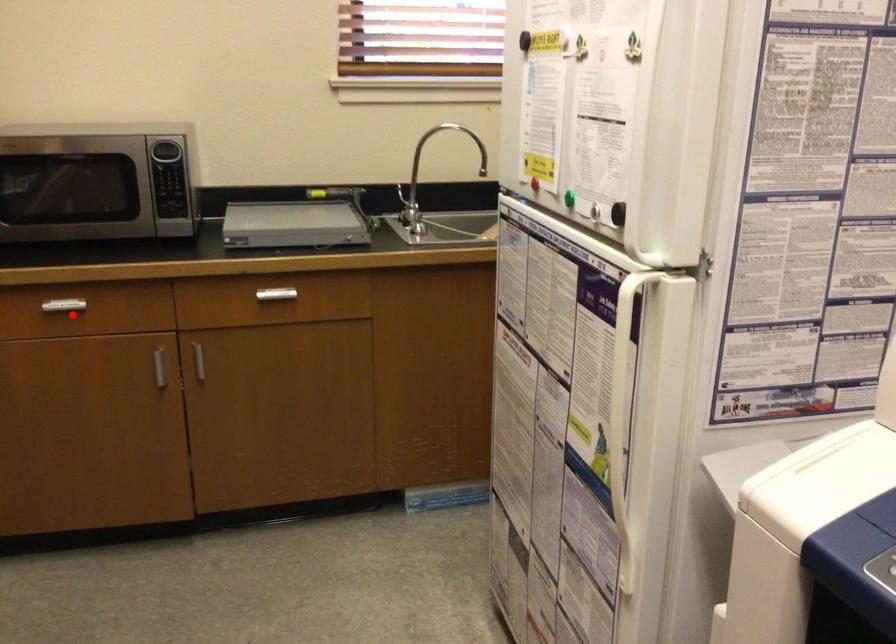
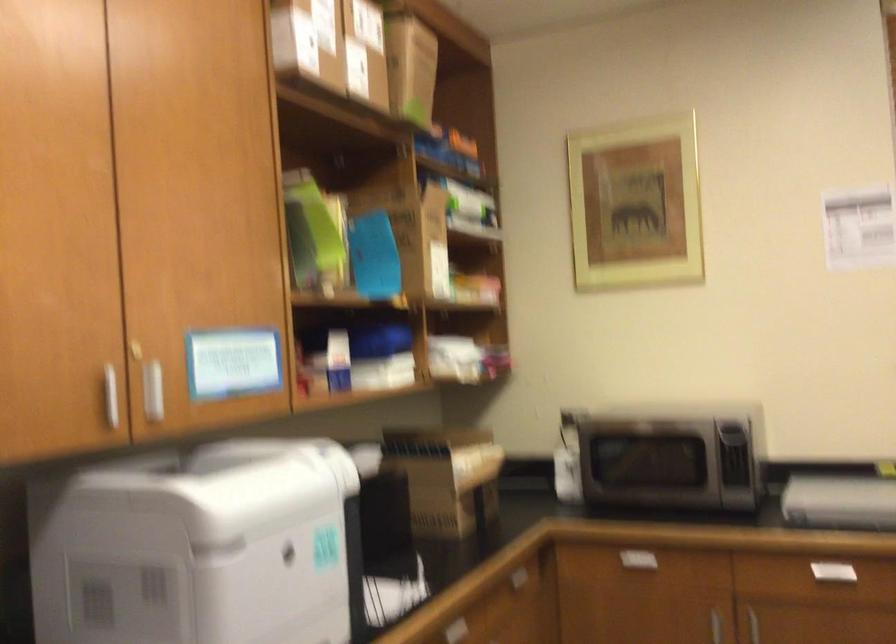
Question: I am providing you with two images of the same scene from different viewpoints. A red point is shown in image1. For the corresponding object point in image2, is it positioned nearer or farther from the camera?

Choices:
 (A) Nearer
 (B) Farther

Answer: (B)